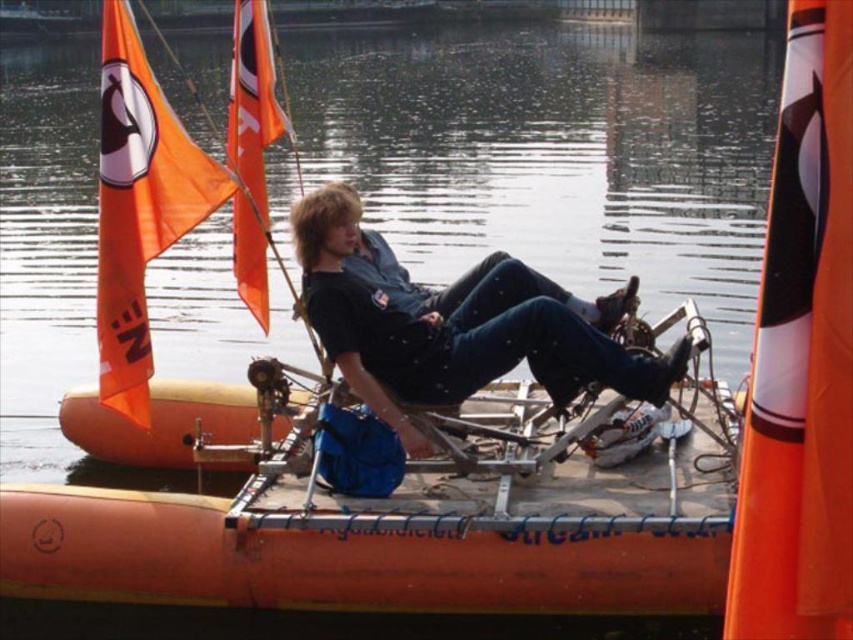
You are a passenger on a boat and you see the transparent water at center and the black matte shirt at center. Which object is located to the left of the other?

The transparent water at center is to the left of the black matte shirt at center.

You are a swimmer who wants to jump into the water. You see the transparent water at center and the black matte shirt at center. Which one is bigger in size?

The transparent water at center has a larger size compared to the black matte shirt at center, so you should jump into the transparent water at center.